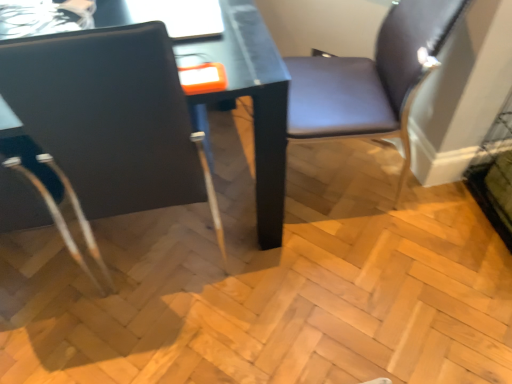
Question: From the image's perspective, is purple leather chair at right, placed as the second chair when sorted from left to right, positioned above or below matte black chair at left, arranged as the 2th chair when viewed from the right?

Choices:
 (A) above
 (B) below

Answer: (A)

Question: Would you say purple leather chair at right, placed as the second chair when sorted from left to right, is to the left or to the right of matte black chair at left, placed as the 1th chair when sorted from left to right, in the picture?

Choices:
 (A) left
 (B) right

Answer: (B)

Question: Based on their sizes in the image, would you say purple leather chair at right, the first chair positioned from the right, is bigger or smaller than matte black chair at left, placed as the 1th chair when sorted from left to right?

Choices:
 (A) small
 (B) big

Answer: (A)

Question: Is matte black chair at left, placed as the 1th chair when sorted from left to right, taller or shorter than purple leather chair at right, the first chair positioned from the right?

Choices:
 (A) short
 (B) tall

Answer: (B)

Question: Relative to purple leather chair at right, placed as the second chair when sorted from left to right, is matte black chair at left, placed as the 1th chair when sorted from left to right, in front or behind?

Choices:
 (A) behind
 (B) front

Answer: (B)

Question: Is matte black chair at left, placed as the 1th chair when sorted from left to right, situated inside purple leather chair at right, the first chair positioned from the right, or outside?

Choices:
 (A) inside
 (B) outside

Answer: (B)

Question: From the image's perspective, is matte black chair at left, arranged as the 2th chair when viewed from the right, positioned above or below purple leather chair at right, placed as the second chair when sorted from left to right?

Choices:
 (A) above
 (B) below

Answer: (B)